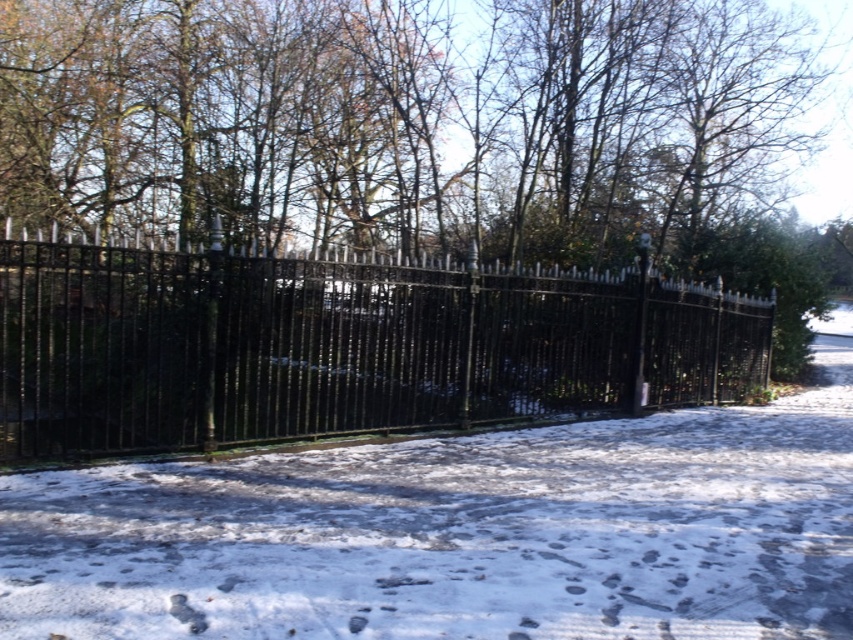
You are standing in front of the black wrought iron fence at center and want to walk through the area where the white snow at center is located. Can you pass through the snow area without stepping on the fence?

The white snow at center is located below the black wrought iron fence at center, so you can walk through the snow area without stepping on the fence as it is positioned below it.

Looking at this image, you are standing at the closed gate of the black wrought iron fence and see two points marked in the snow. The first point is at coordinate point (766, 605) and the second is at coordinate point (61, 326). Which point is closer to you?

Point (766, 605) is in front of point (61, 326), so it is closer to you.

You are standing in front of the black wrought iron fence at center and want to walk to the white snow at center. Which direction should you move relative to the fence?

You should move to the right of the black wrought iron fence at center because the white snow at center is located to the right of it.